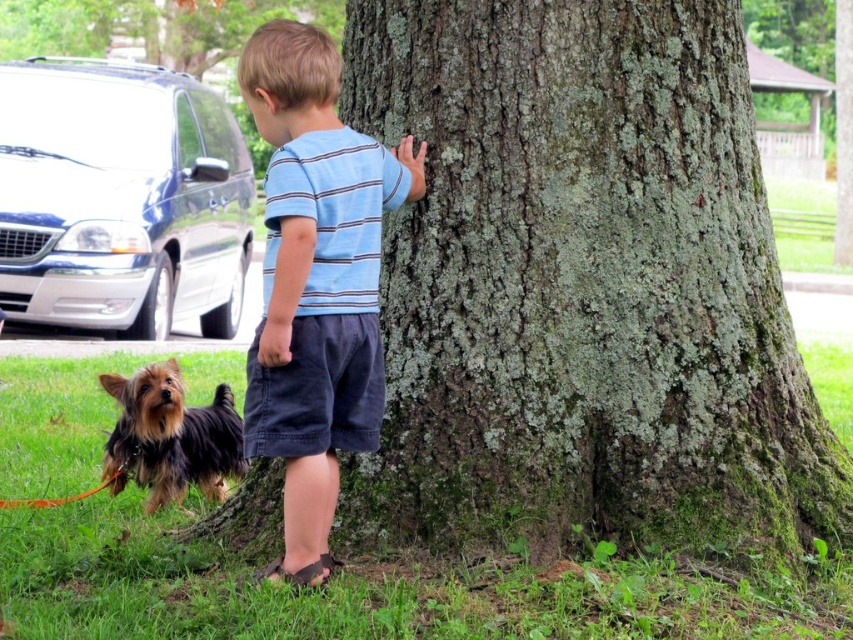
Question: Which point is closer to the camera?

Choices:
 (A) (138, 426)
 (B) (345, 333)

Answer: (B)

Question: Is the position of green mossy bark at center less distant than that of blue striped shirt at center?

Choices:
 (A) no
 (B) yes

Answer: (A)

Question: Which point is farther to the camera?

Choices:
 (A) (322, 260)
 (B) (152, 509)

Answer: (B)

Question: Is green mossy bark at center thinner than blue striped shirt at center?

Choices:
 (A) yes
 (B) no

Answer: (B)

Question: Is green mossy bark at center above blue striped shirt at center?

Choices:
 (A) no
 (B) yes

Answer: (B)

Question: Which object appears farthest from the camera in this image?

Choices:
 (A) blue striped shirt at center
 (B) shaggy brown fur at lower left

Answer: (B)